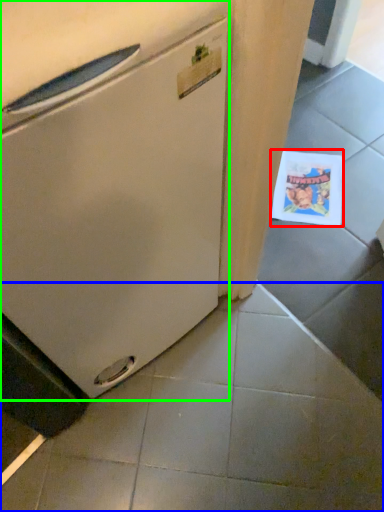
Question: Estimate the real-world distances between objects in this image. Which object is closer to postcard (highlighted by a red box), tile (highlighted by a blue box) or refrigerator (highlighted by a green box)?

Choices:
 (A) tile
 (B) refrigerator

Answer: (A)